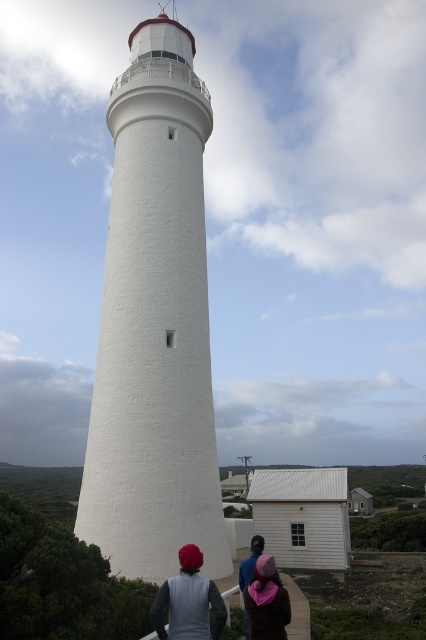
Is white textured lighthouse at center wider than pink fabric hat at lower center?

Yes.

Is white textured lighthouse at center smaller than pink fabric hat at lower center?

No, white textured lighthouse at center is not smaller than pink fabric hat at lower center.

The width and height of the screenshot is (426, 640). What do you see at coordinates (155, 324) in the screenshot?
I see `white textured lighthouse at center` at bounding box center [155, 324].

Identify the location of white textured lighthouse at center. (155, 324).

Can you confirm if white textured lighthouse at center is shorter than pink fabric at lower center?

Incorrect, white textured lighthouse at center's height does not fall short of pink fabric at lower center's.

Who is shorter, white textured lighthouse at center or pink fabric at lower center?

Standing shorter between the two is pink fabric at lower center.

Which is in front, point (95, 381) or point (149, 618)?

Point (149, 618) is in front.

In order to click on white textured lighthouse at center in this screenshot , I will do `click(155, 324)`.

Is point (187, 577) positioned behind point (273, 564)?

No, (187, 577) is closer to viewer.

Does pink fabric at lower center appear on the right side of pink fabric hat at lower center?

No, pink fabric at lower center is not to the right of pink fabric hat at lower center.

You are a GUI agent. You are given a task and a screenshot of the screen. Output one action in this format:
    pyautogui.click(x=<x>, y=<y>)
    Task: Click on the pink fabric at lower center
    The height and width of the screenshot is (640, 426).
    Given the screenshot: What is the action you would take?
    pyautogui.click(x=189, y=612)